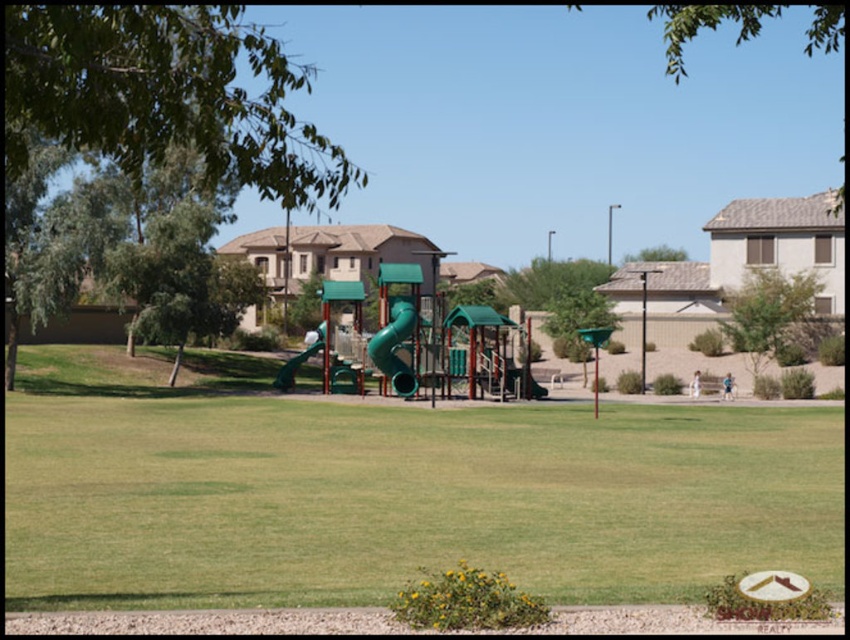
Is green matte slide at center wider than light blue denim shorts at lower right?

No.

Locate an element on the screen. green matte slide at center is located at coordinates (395, 348).

Based on the photo, does light blue denim shorts at lower right appear on the left side of white fabric child at lower right?

Incorrect, light blue denim shorts at lower right is not on the left side of white fabric child at lower right.

What do you see at coordinates (727, 387) in the screenshot? The image size is (850, 640). I see `light blue denim shorts at lower right` at bounding box center [727, 387].

Is point (732, 376) closer to camera compared to point (693, 380)?

No, it is not.

The image size is (850, 640). In order to click on light blue denim shorts at lower right in this screenshot , I will do `click(727, 387)`.

Between point (409, 316) and point (314, 342), which one is positioned in front?

Point (409, 316) is more forward.

Is green matte slide at center below green rubber slide at center?

Correct, green matte slide at center is located below green rubber slide at center.

Is point (374, 353) closer to camera compared to point (278, 371)?

Yes.

The width and height of the screenshot is (850, 640). Find the location of `green matte slide at center`. green matte slide at center is located at coordinates pyautogui.click(x=395, y=348).